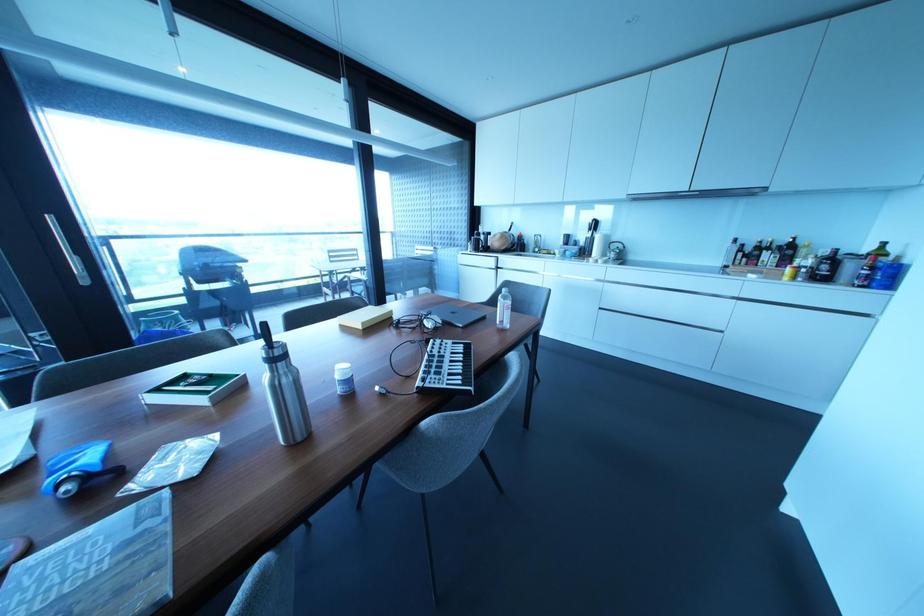
Locate an element on the screen. The width and height of the screenshot is (924, 616). kettle handle is located at coordinates (615, 251).